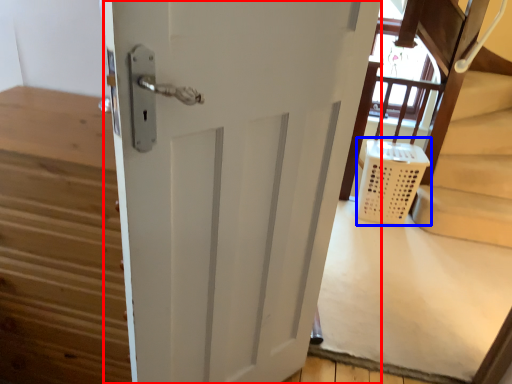
Question: Which object is closer to the camera taking this photo, door (highlighted by a red box) or laundry basket (highlighted by a blue box)?

Choices:
 (A) door
 (B) laundry basket

Answer: (A)